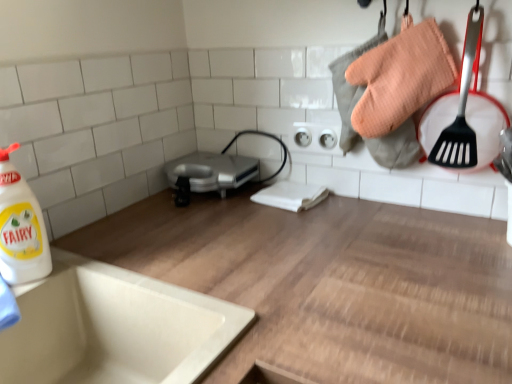
Question: Is silver metallic toaster at center taller or shorter than white glossy bottle at left?

Choices:
 (A) tall
 (B) short

Answer: (B)

Question: From the image's perspective, relative to white glossy bottle at left, is silver metallic toaster at center above or below?

Choices:
 (A) above
 (B) below

Answer: (A)

Question: Considering the real-world distances, which object is closest to the white glossy bottle at left?

Choices:
 (A) white ceramic sink at lower left
 (B) wooden at upper center
 (C) silver metallic toaster at center

Answer: (A)

Question: Estimate the real-world distances between objects in this image. Which object is farther from the white glossy bottle at left?

Choices:
 (A) white ceramic sink at lower left
 (B) silver metallic toaster at center
 (C) wooden at upper center

Answer: (B)